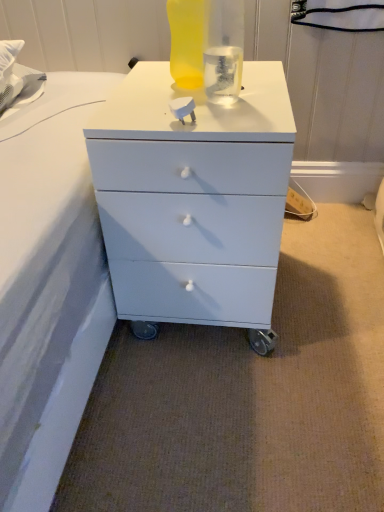
Question: Is white matte chest of drawers at center taller or shorter than translucent yellow bottle at upper center?

Choices:
 (A) short
 (B) tall

Answer: (B)

Question: From a real-world perspective, is white matte chest of drawers at center physically located above or below translucent yellow bottle at upper center?

Choices:
 (A) below
 (B) above

Answer: (A)

Question: Is white matte chest of drawers at center to the left or to the right of translucent yellow bottle at upper center in the image?

Choices:
 (A) right
 (B) left

Answer: (A)

Question: From a real-world perspective, relative to white matte chest of drawers at center, is translucent yellow bottle at upper center vertically above or below?

Choices:
 (A) above
 (B) below

Answer: (A)

Question: Is point (185, 2) positioned closer to the camera than point (283, 93)?

Choices:
 (A) farther
 (B) closer

Answer: (A)

Question: From their relative heights in the image, would you say translucent yellow bottle at upper center is taller or shorter than white matte chest of drawers at center?

Choices:
 (A) tall
 (B) short

Answer: (B)

Question: Is translucent yellow bottle at upper center in front of or behind white matte chest of drawers at center in the image?

Choices:
 (A) front
 (B) behind

Answer: (B)